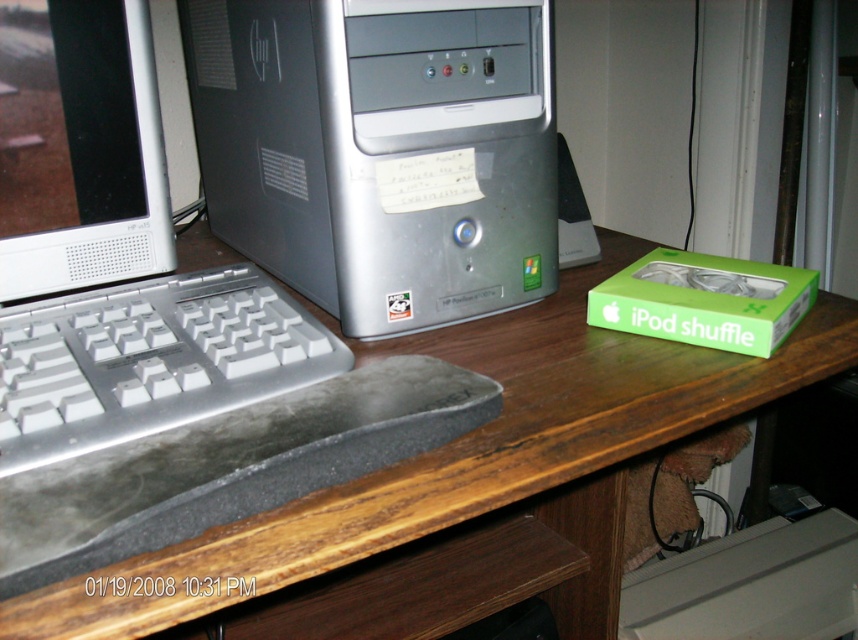
Question: Which object is farther from the camera taking this photo?

Choices:
 (A) black rubber mouse at center
 (B) wooden at center

Answer: (A)

Question: Which object is the farthest from the wooden at center?

Choices:
 (A) silver/plastic keyboard at lower left
 (B) silver metallic computer tower at center
 (C) green matte ipod shuffle box at right
 (D) white plastic computer monitor at left

Answer: (D)

Question: Is silver metallic computer tower at center bigger than black rubber mouse at center?

Choices:
 (A) no
 (B) yes

Answer: (B)

Question: Can you confirm if silver metallic computer tower at center is smaller than green matte ipod shuffle box at right?

Choices:
 (A) no
 (B) yes

Answer: (A)

Question: Can you confirm if wooden at center is positioned to the right of silver/plastic keyboard at lower left?

Choices:
 (A) yes
 (B) no

Answer: (A)

Question: Which of the following is the closest to the observer?

Choices:
 (A) white plastic computer monitor at left
 (B) silver/plastic keyboard at lower left

Answer: (B)